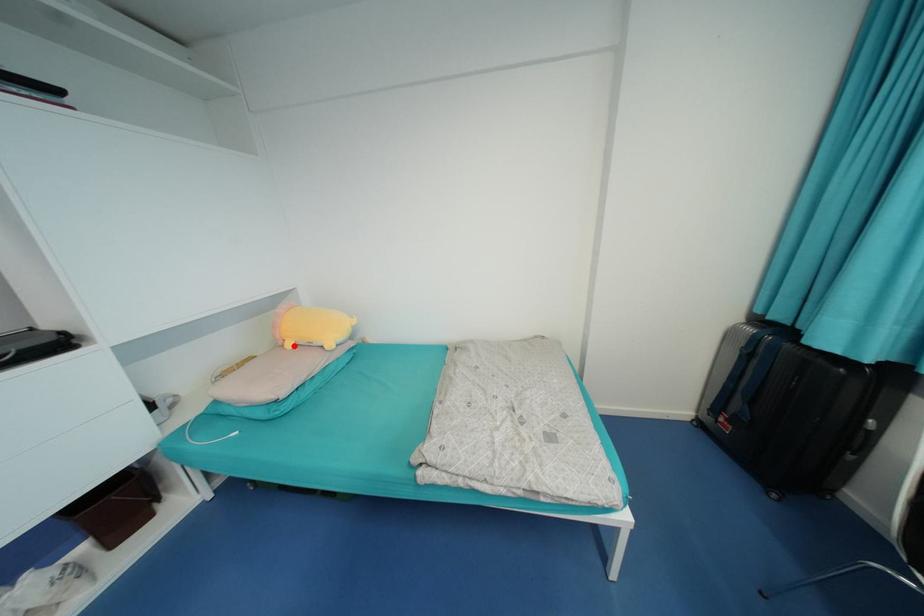
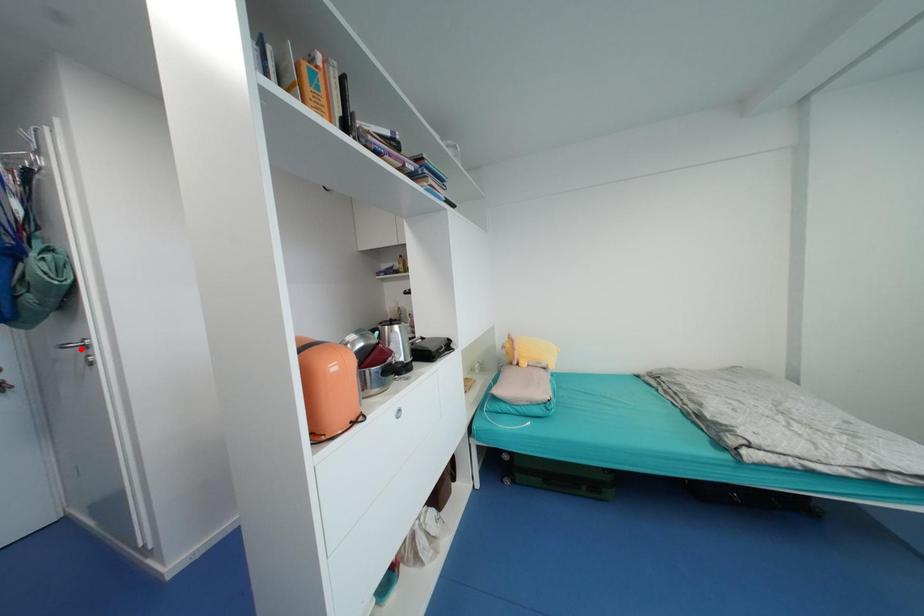
I am providing you with two images of the same scene from different viewpoints. A red point is marked on the first image and another point is marked on the second image. Does the point marked in image1 correspond to the same location as the one in image2?

No